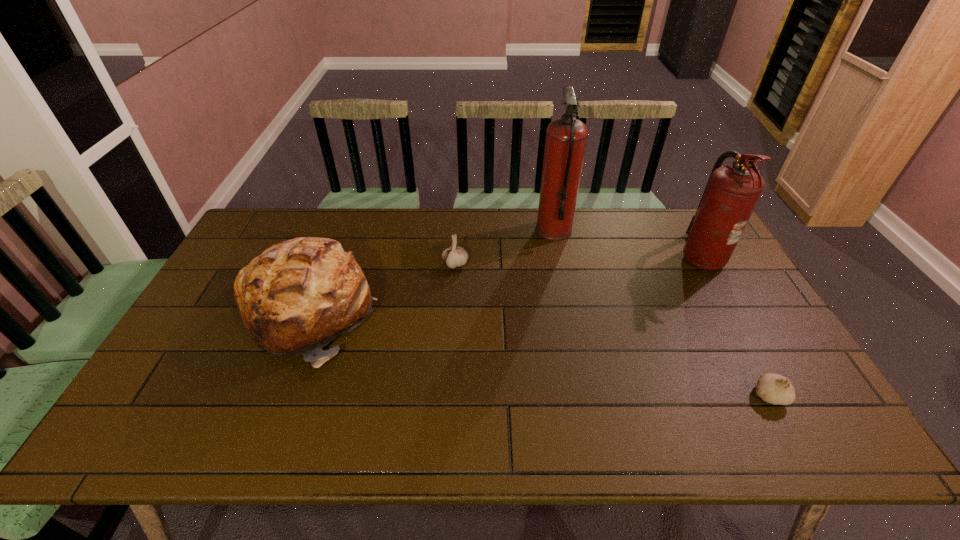
The image size is (960, 540). I want to click on blank area located 0.200m at the nozzle of the left fire extinguisher, so click(479, 231).

The height and width of the screenshot is (540, 960). Identify the location of blank area located at the nozzle of the left fire extinguisher. (505, 231).

Where is `free region located 0.050m at the front of the right fire extinguisher where the nozzle is aimed`? The width and height of the screenshot is (960, 540). free region located 0.050m at the front of the right fire extinguisher where the nozzle is aimed is located at coordinates (664, 255).

This screenshot has width=960, height=540. I want to click on free region located 0.130m at the front of the right fire extinguisher where the nozzle is aimed, so click(639, 255).

Locate an element on the screen. The image size is (960, 540). free spot located 0.050m at the front of the right fire extinguisher where the nozzle is aimed is located at coordinates (664, 255).

Locate an element on the screen. The height and width of the screenshot is (540, 960). free space located on the back of the third tallest object is located at coordinates (343, 225).

Find the location of `blank space located on the left of the second object from left to right`. blank space located on the left of the second object from left to right is located at coordinates (361, 264).

Locate an element on the screen. The height and width of the screenshot is (540, 960). vacant region located on the left of the nearer garlic is located at coordinates [723, 395].

In order to click on object positioned at the left edge in this screenshot , I will do `click(298, 295)`.

Where is `fire extinguisher that is at the right edge`? The image size is (960, 540). fire extinguisher that is at the right edge is located at coordinates (732, 192).